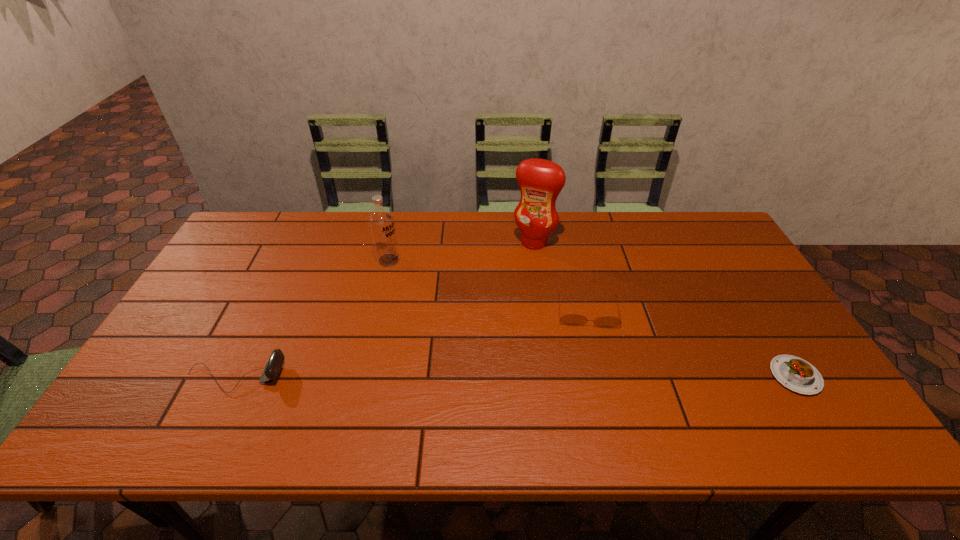
At what (x,y) coordinates should I click in order to perform the action: click on vacant spot on the desktop that is between the leftmost object and the rightmost object and is positioned on the label side of the tallest object. Please return your answer as a coordinate pair (x, y). This screenshot has height=540, width=960. Looking at the image, I should click on (464, 376).

At what (x,y) coordinates should I click in order to perform the action: click on vacant space on the desktop that is between the leftmost object and the rightmost object and is positioned on the face of the sunglasses. Please return your answer as a coordinate pair (x, y). This screenshot has height=540, width=960. Looking at the image, I should click on (595, 376).

You are a GUI agent. You are given a task and a screenshot of the screen. Output one action in this format:
    pyautogui.click(x=<x>, y=<y>)
    Task: Click on the free space on the desktop that is between the webcam and the rightmost object and is positioned on the front label of the vodka
    The width and height of the screenshot is (960, 540).
    Given the screenshot: What is the action you would take?
    pyautogui.click(x=581, y=376)